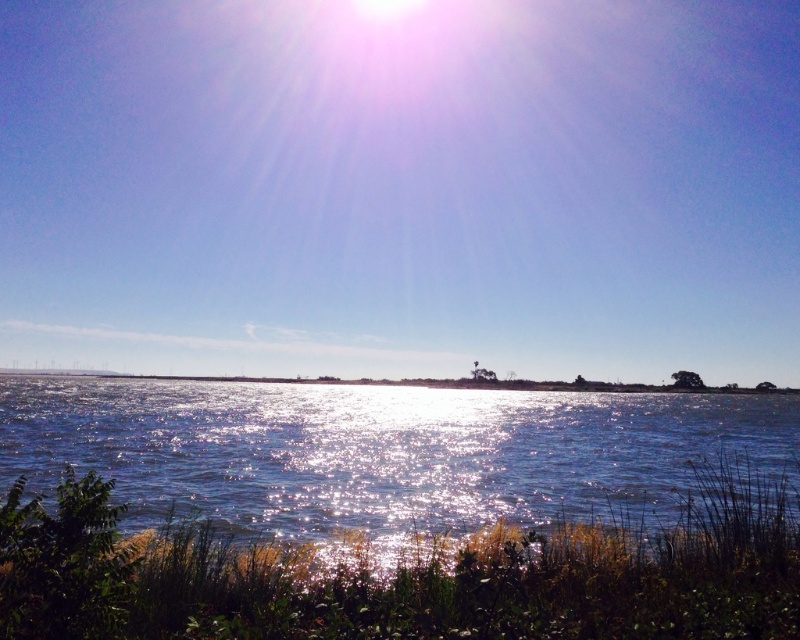
Can you confirm if bright blue sky at upper center is taller than sparkling blue water at center?

Yes.

Does point (632, 356) lie behind point (558, 436)?

Yes.

Where is `bright blue sky at upper center`? The width and height of the screenshot is (800, 640). bright blue sky at upper center is located at coordinates (402, 186).